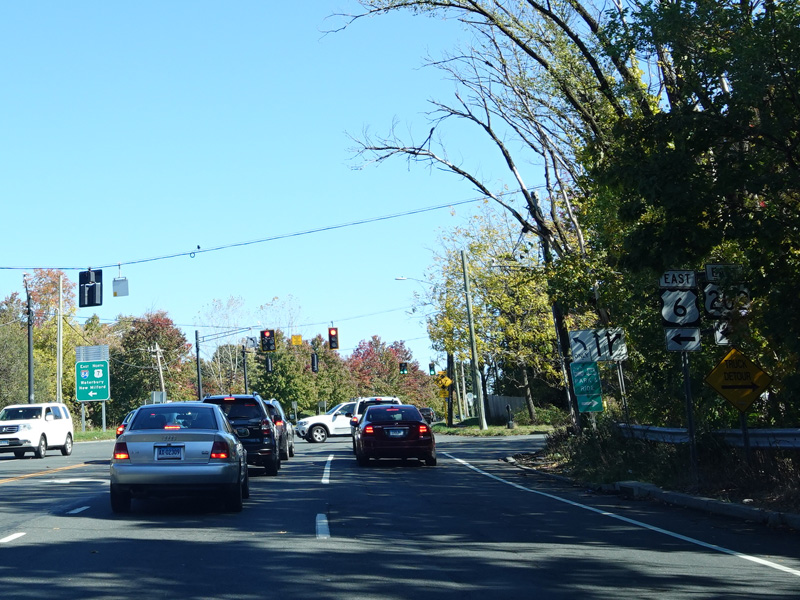
Find the location of a particular element. Image resolution: width=800 pixels, height=600 pixels. white paint is located at coordinates (318, 521), (329, 466), (10, 538), (80, 505), (80, 479), (592, 510).